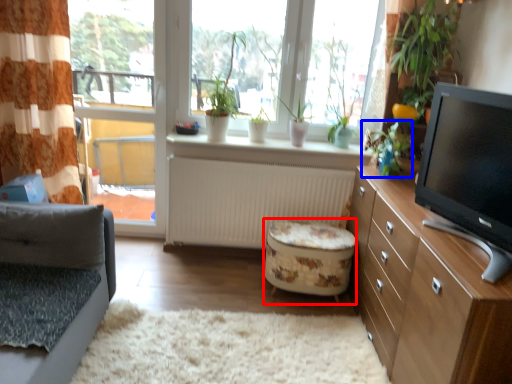
Question: Which of the following is the farthest to the observer, stool (highlighted by a red box) or plant (highlighted by a blue box)?

Choices:
 (A) stool
 (B) plant

Answer: (A)